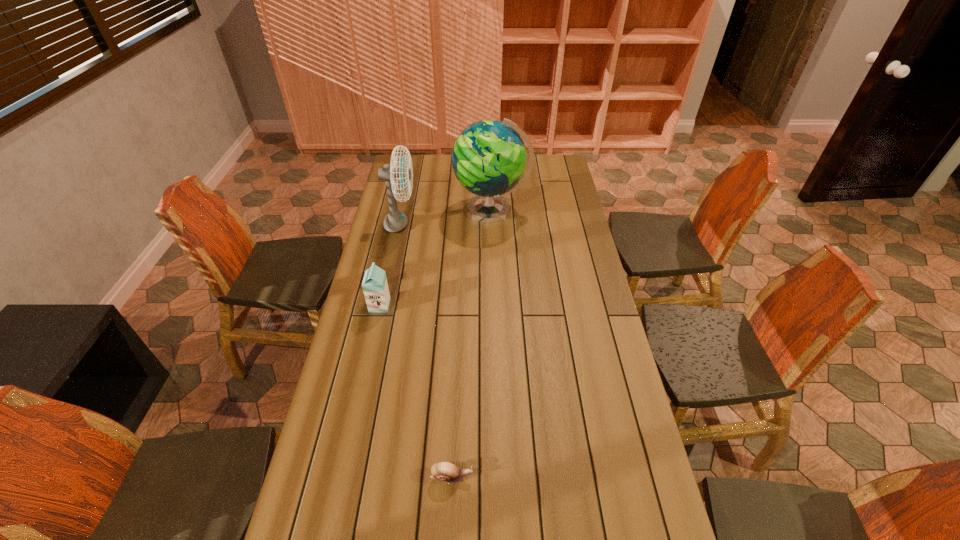
What are the coordinates of `the tallest object` in the screenshot? It's located at (489, 158).

Find the location of a particular element. fan is located at coordinates [x=395, y=220].

The width and height of the screenshot is (960, 540). I want to click on the third farthest object, so click(x=375, y=287).

You are a GUI agent. You are given a task and a screenshot of the screen. Output one action in this format:
    pyautogui.click(x=<x>, y=<y>)
    Task: Click on the third tallest object
    The width and height of the screenshot is (960, 540).
    Given the screenshot: What is the action you would take?
    pyautogui.click(x=375, y=287)

Where is `the nearest object`? This screenshot has width=960, height=540. the nearest object is located at coordinates (443, 471).

This screenshot has height=540, width=960. Find the location of `escargot`. escargot is located at coordinates point(443,471).

What are the coordinates of `vacant space situated 0.180m on the front surface of the tallest object` in the screenshot? It's located at [x=415, y=211].

Where is `vacant space located on the front surface of the tallest object`? The width and height of the screenshot is (960, 540). vacant space located on the front surface of the tallest object is located at coordinates (402, 211).

Find the location of `blank space located on the front surface of the tallest object`. blank space located on the front surface of the tallest object is located at coordinates (413, 211).

I want to click on free space located 0.380m on the front-facing side of the fan, so click(502, 225).